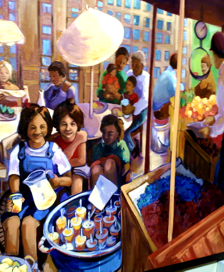
Locate an element on the screen. The width and height of the screenshot is (224, 272). windows in building is located at coordinates (134, 18), (156, 57).